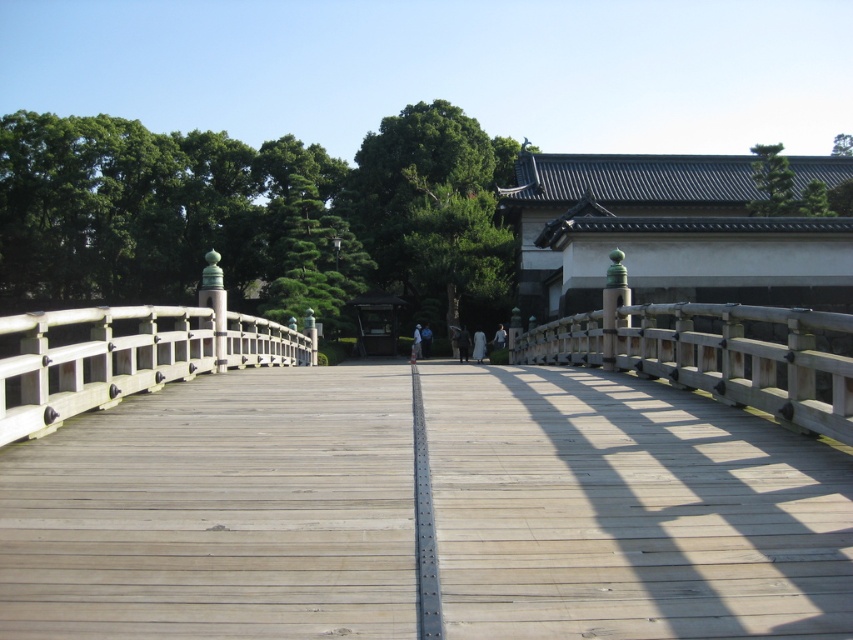
Question: Among these points, which one is farthest from the camera?

Choices:
 (A) (409, 413)
 (B) (267, 337)
 (C) (762, 355)

Answer: (B)

Question: Is light brown wood bridge at center smaller than white wood rail at left?

Choices:
 (A) yes
 (B) no

Answer: (A)

Question: Is light brown wood bridge at center bigger than wooden rail at center?

Choices:
 (A) yes
 (B) no

Answer: (B)

Question: Which is nearer to the white wood rail at left?

Choices:
 (A) wooden rail at center
 (B) light brown wood bridge at center

Answer: (A)

Question: Considering the relative positions of light brown wood bridge at center and wooden rail at center in the image provided, where is light brown wood bridge at center located with respect to wooden rail at center?

Choices:
 (A) right
 (B) left

Answer: (B)

Question: Among these points, which one is farthest from the camera?

Choices:
 (A) (260, 333)
 (B) (851, 426)
 (C) (550, 422)

Answer: (A)